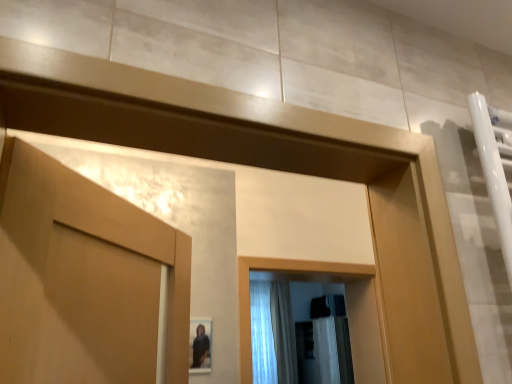
Looking at this image, measure the distance between point (292,348) and camera.

The depth of point (292,348) is 5.41 meters.

I want to click on white sheer fabric at center, acting as the second shower curtain starting from the left, so click(x=283, y=333).

This screenshot has height=384, width=512. What do you see at coordinates (283, 333) in the screenshot? I see `white sheer fabric at center, which is counted as the first shower curtain, starting from the right` at bounding box center [283, 333].

Measure the distance between point (253, 343) and camera.

The depth of point (253, 343) is 3.87 meters.

This screenshot has height=384, width=512. I want to click on white sheer fabric at center, positioned as the first shower curtain in left-to-right order, so click(x=262, y=334).

What do you see at coordinates (262, 334) in the screenshot?
I see `white sheer fabric at center, positioned as the first shower curtain in left-to-right order` at bounding box center [262, 334].

How much space does white sheer fabric at center, positioned as the first shower curtain in left-to-right order, occupy horizontally?

white sheer fabric at center, positioned as the first shower curtain in left-to-right order, is 23.08 centimeters in width.

At what (x,y) coordinates should I click in order to perform the action: click on white sheer fabric at center, which is counted as the first shower curtain, starting from the right. Please return your answer as a coordinate pair (x, y). Looking at the image, I should click on (283, 333).

Can you confirm if white sheer fabric at center, acting as the second shower curtain starting from the left, is positioned to the right of white sheer fabric at center, the 2th shower curtain in the right-to-left sequence?

Correct, you'll find white sheer fabric at center, acting as the second shower curtain starting from the left, to the right of white sheer fabric at center, the 2th shower curtain in the right-to-left sequence.

Is the depth of white sheer fabric at center, which is counted as the first shower curtain, starting from the right, greater than that of white sheer fabric at center, the 2th shower curtain in the right-to-left sequence?

Yes, white sheer fabric at center, which is counted as the first shower curtain, starting from the right, is further from the camera.

Considering the positions of point (271, 290) and point (266, 372), is point (271, 290) closer or farther from the camera than point (266, 372)?

Point (271, 290) is farther from the camera than point (266, 372).

From the image's perspective, who appears lower, white sheer fabric at center, acting as the second shower curtain starting from the left, or white sheer fabric at center, the 2th shower curtain in the right-to-left sequence?

From the image's view, white sheer fabric at center, acting as the second shower curtain starting from the left, is below.

From a real-world perspective, is white sheer fabric at center, which is counted as the first shower curtain, starting from the right, on white sheer fabric at center, the 2th shower curtain in the right-to-left sequence?

No, from a real-world perspective, white sheer fabric at center, which is counted as the first shower curtain, starting from the right, is not over white sheer fabric at center, the 2th shower curtain in the right-to-left sequence

Can you confirm if white sheer fabric at center, acting as the second shower curtain starting from the left, is wider than white sheer fabric at center, the 2th shower curtain in the right-to-left sequence?

Indeed, white sheer fabric at center, acting as the second shower curtain starting from the left, has a greater width compared to white sheer fabric at center, the 2th shower curtain in the right-to-left sequence.

Who is shorter, white sheer fabric at center, which is counted as the first shower curtain, starting from the right, or white sheer fabric at center, positioned as the first shower curtain in left-to-right order?

Standing shorter between the two is white sheer fabric at center, positioned as the first shower curtain in left-to-right order.

Looking at the image, does white sheer fabric at center, acting as the second shower curtain starting from the left, seem bigger or smaller compared to white sheer fabric at center, positioned as the first shower curtain in left-to-right order?

Clearly, white sheer fabric at center, acting as the second shower curtain starting from the left, is larger in size than white sheer fabric at center, positioned as the first shower curtain in left-to-right order.

Is white sheer fabric at center, acting as the second shower curtain starting from the left, spatially inside white sheer fabric at center, the 2th shower curtain in the right-to-left sequence, or outside of it?

white sheer fabric at center, acting as the second shower curtain starting from the left, cannot be found inside white sheer fabric at center, the 2th shower curtain in the right-to-left sequence.

Is white sheer fabric at center, which is counted as the first shower curtain, starting from the right, directly adjacent to white sheer fabric at center, positioned as the first shower curtain in left-to-right order?

No, white sheer fabric at center, which is counted as the first shower curtain, starting from the right, is not in contact with white sheer fabric at center, positioned as the first shower curtain in left-to-right order.

Is white sheer fabric at center, which is counted as the first shower curtain, starting from the right, positioned with its back to white sheer fabric at center, the 2th shower curtain in the right-to-left sequence?

No, white sheer fabric at center, which is counted as the first shower curtain, starting from the right, is not facing away from white sheer fabric at center, the 2th shower curtain in the right-to-left sequence.

How different are the orientations of white sheer fabric at center, which is counted as the first shower curtain, starting from the right, and white sheer fabric at center, the 2th shower curtain in the right-to-left sequence, in degrees?

The angular difference between white sheer fabric at center, which is counted as the first shower curtain, starting from the right, and white sheer fabric at center, the 2th shower curtain in the right-to-left sequence, is 6.57e-05 degrees.

How much distance is there between white sheer fabric at center, which is counted as the first shower curtain, starting from the right, and white sheer fabric at center, positioned as the first shower curtain in left-to-right order?

7.55 inches.

The image size is (512, 384). Find the location of `shower curtain located underneath the white sheer fabric at center, positioned as the first shower curtain in left-to-right order (from a real-world perspective)`. shower curtain located underneath the white sheer fabric at center, positioned as the first shower curtain in left-to-right order (from a real-world perspective) is located at coordinates (283, 333).

Can you confirm if white sheer fabric at center, the 2th shower curtain in the right-to-left sequence, is positioned to the right of white sheer fabric at center, which is counted as the first shower curtain, starting from the right?

No, white sheer fabric at center, the 2th shower curtain in the right-to-left sequence, is not to the right of white sheer fabric at center, which is counted as the first shower curtain, starting from the right.

Is white sheer fabric at center, the 2th shower curtain in the right-to-left sequence, in front of or behind white sheer fabric at center, acting as the second shower curtain starting from the left, in the image?

white sheer fabric at center, the 2th shower curtain in the right-to-left sequence, is in front of white sheer fabric at center, acting as the second shower curtain starting from the left.

Does point (253, 336) lie in front of point (291, 330)?

Yes, it is in front of point (291, 330).

From the image's perspective, is white sheer fabric at center, positioned as the first shower curtain in left-to-right order, positioned above or below white sheer fabric at center, which is counted as the first shower curtain, starting from the right?

Based on their image positions, white sheer fabric at center, positioned as the first shower curtain in left-to-right order, is located above white sheer fabric at center, which is counted as the first shower curtain, starting from the right.

From a real-world perspective, between white sheer fabric at center, the 2th shower curtain in the right-to-left sequence, and white sheer fabric at center, which is counted as the first shower curtain, starting from the right, who is vertically higher?

From a 3D spatial view, white sheer fabric at center, the 2th shower curtain in the right-to-left sequence, is above.

Considering the sizes of white sheer fabric at center, the 2th shower curtain in the right-to-left sequence, and white sheer fabric at center, acting as the second shower curtain starting from the left, in the image, is white sheer fabric at center, the 2th shower curtain in the right-to-left sequence, wider or thinner than white sheer fabric at center, acting as the second shower curtain starting from the left,?

white sheer fabric at center, the 2th shower curtain in the right-to-left sequence, is thinner than white sheer fabric at center, acting as the second shower curtain starting from the left.

From the picture: Considering the relative sizes of white sheer fabric at center, the 2th shower curtain in the right-to-left sequence, and white sheer fabric at center, which is counted as the first shower curtain, starting from the right, in the image provided, is white sheer fabric at center, the 2th shower curtain in the right-to-left sequence, shorter than white sheer fabric at center, which is counted as the first shower curtain, starting from the right,?

Correct, white sheer fabric at center, the 2th shower curtain in the right-to-left sequence, is not as tall as white sheer fabric at center, which is counted as the first shower curtain, starting from the right.

Considering the sizes of objects white sheer fabric at center, positioned as the first shower curtain in left-to-right order, and white sheer fabric at center, which is counted as the first shower curtain, starting from the right, in the image provided, who is bigger, white sheer fabric at center, positioned as the first shower curtain in left-to-right order, or white sheer fabric at center, which is counted as the first shower curtain, starting from the right,?

white sheer fabric at center, which is counted as the first shower curtain, starting from the right.

Is white sheer fabric at center, the 2th shower curtain in the right-to-left sequence, positioned beyond the bounds of white sheer fabric at center, acting as the second shower curtain starting from the left?

Yes, white sheer fabric at center, the 2th shower curtain in the right-to-left sequence, is outside of white sheer fabric at center, acting as the second shower curtain starting from the left.

Is white sheer fabric at center, the 2th shower curtain in the right-to-left sequence, touching white sheer fabric at center, which is counted as the first shower curtain, starting from the right?

No, white sheer fabric at center, the 2th shower curtain in the right-to-left sequence, is not beside white sheer fabric at center, which is counted as the first shower curtain, starting from the right.

Is white sheer fabric at center, which is counted as the first shower curtain, starting from the right, at the back of white sheer fabric at center, the 2th shower curtain in the right-to-left sequence?

No, white sheer fabric at center, which is counted as the first shower curtain, starting from the right, is not at the back of white sheer fabric at center, the 2th shower curtain in the right-to-left sequence.

At what (x,y) coordinates should I click in order to perform the action: click on shower curtain lying above the white sheer fabric at center, acting as the second shower curtain starting from the left (from the image's perspective). Please return your answer as a coordinate pair (x, y). The width and height of the screenshot is (512, 384). Looking at the image, I should click on coord(262,334).

Image resolution: width=512 pixels, height=384 pixels. Identify the location of shower curtain beneath the white sheer fabric at center, the 2th shower curtain in the right-to-left sequence (from a real-world perspective). (283, 333).

I want to click on shower curtain behind the white sheer fabric at center, the 2th shower curtain in the right-to-left sequence, so click(x=283, y=333).